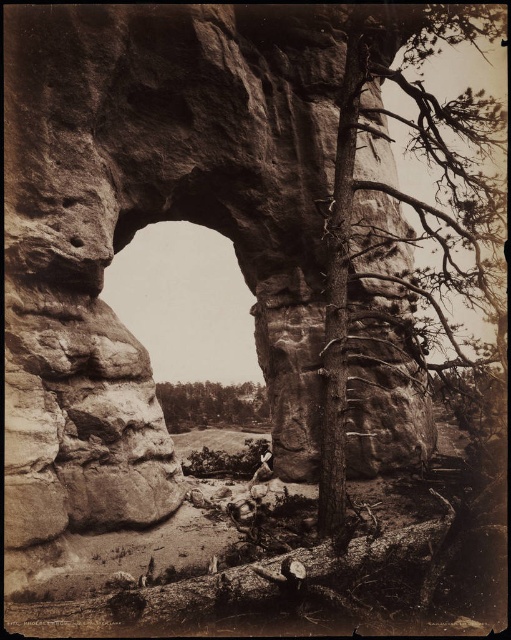
You are standing at the base of the large rock formation and want to place a 2.5 meter long ladder between the smooth brown log at lower center and your current position. Is there enough space to place the ladder horizontally without it touching the log or the rock formation?

The distance between the smooth brown log at lower center and the camera is 7.25 meters. Since the ladder is only 2.5 meters long, placing it horizontally between the log and your position would leave ample space, so yes, there is enough space.

You are standing in front of the rock formation and want to take a photo of both the smooth brown log at lower center and the green leafy tree at center. Which object should you focus on first to ensure both are in sharp focus?

You should focus on the smooth brown log at lower center first because it is closer to you than the green leafy tree at center, allowing the camera to adjust focus for both objects in the scene.